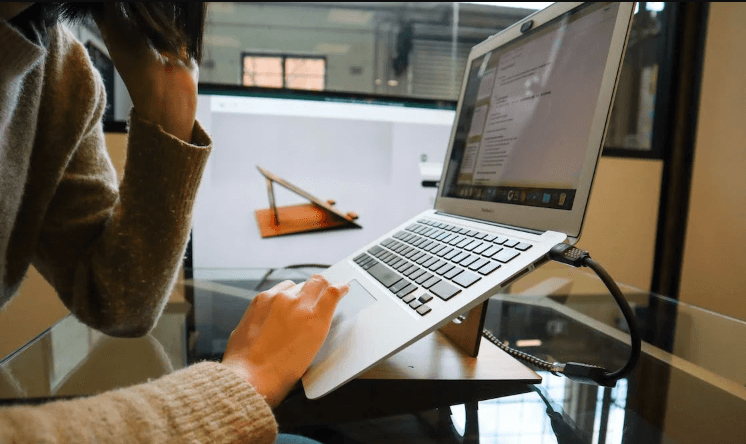
Image resolution: width=746 pixels, height=444 pixels. I want to click on wall, so click(709, 197), click(618, 219).